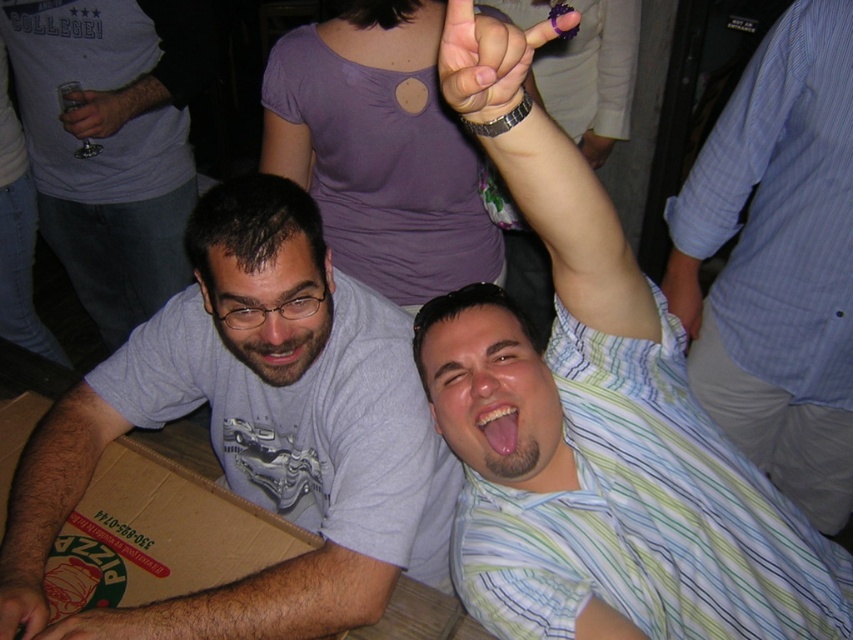
You are standing in the crowd at the party and want to locate the green striped shirt at upper right and the hair at lower left. Which object is positioned higher in the image?

The green striped shirt at upper right is located above hair at lower left, so it is positioned higher in the image.

You are at a party and want to grab the metallic silver cup at upper left. However, there is a black matte hand at lower left in the way. Can you reach the cup without moving the hand?

The metallic silver cup at upper left is to the left of the black matte hand at lower left, so you can reach the cup without moving the hand since it is positioned to the side of the hand.

You are standing in the crowd at the party and want to hand a drink to the person wearing the green striped shirt at upper right. Considering the distance, can you reach them without moving closer?

The green striped shirt at upper right is 19.13 inches away from the viewer, so you can reach them without moving closer as the distance is within arm reach.